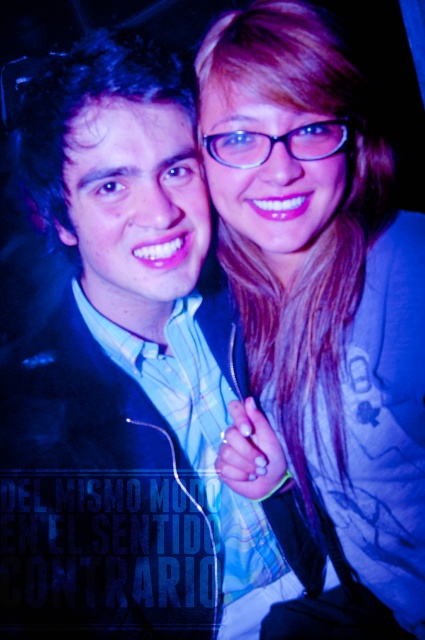
Question: Which point is closer to the camera taking this photo?

Choices:
 (A) (158, 134)
 (B) (413, 582)

Answer: (A)

Question: Which point is farther to the camera?

Choices:
 (A) matte blue jacket at upper right
 (B) matte black suit at center

Answer: (B)

Question: Does matte black suit at center have a smaller size compared to matte blue jacket at upper right?

Choices:
 (A) no
 (B) yes

Answer: (A)

Question: Is matte black suit at center wider than matte blue jacket at upper right?

Choices:
 (A) no
 (B) yes

Answer: (B)

Question: Can you confirm if matte black suit at center is positioned to the left of matte blue jacket at upper right?

Choices:
 (A) no
 (B) yes

Answer: (B)